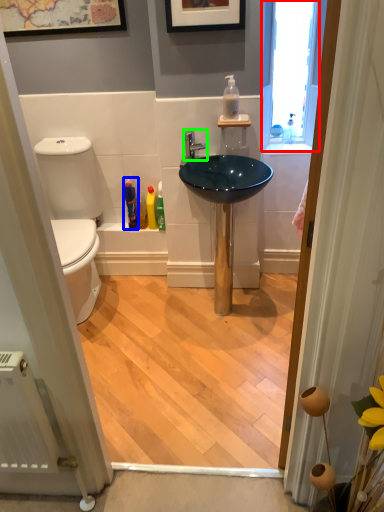
Question: Considering the real-world distances, which object is farthest from window (highlighted by a red box)? toiletry (highlighted by a blue box) or tap (highlighted by a green box)?

Choices:
 (A) toiletry
 (B) tap

Answer: (A)